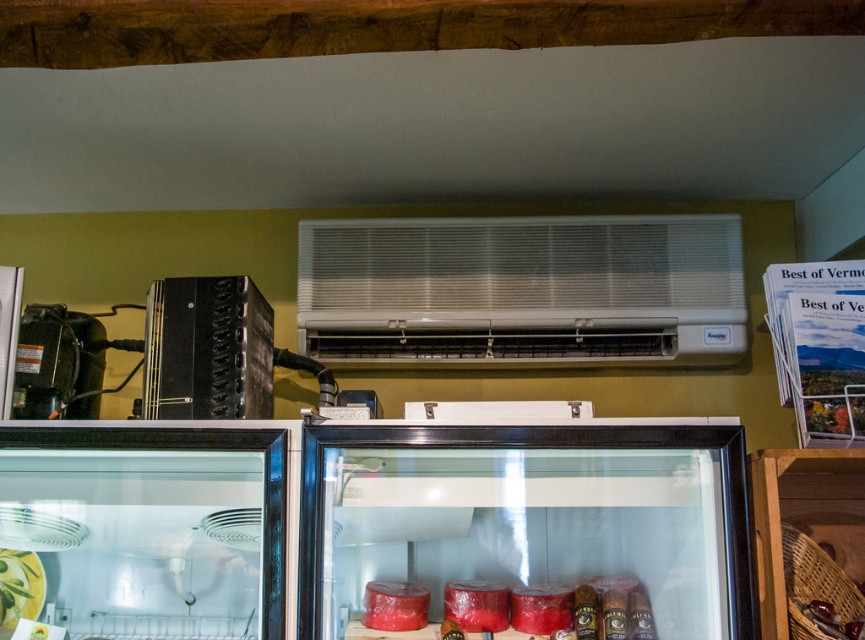
Question: Is the position of red matte container at center more distant than that of glossy red meat at center?

Choices:
 (A) no
 (B) yes

Answer: (B)

Question: Observing the image, what is the correct spatial positioning of white plastic air conditioner at upper center in reference to glossy red meat at center?

Choices:
 (A) above
 (B) below

Answer: (A)

Question: Is black matte accordion at left above red matte container at center?

Choices:
 (A) yes
 (B) no

Answer: (A)

Question: Which object appears farthest from the camera in this image?

Choices:
 (A) shiny red meat at center
 (B) red matte container at center
 (C) glossy red meat at center
 (D) metallic black air conditioner at upper center

Answer: (B)

Question: Which is nearer to the black matte accordion at left?

Choices:
 (A) red matte container at center
 (B) transparent glass door at center
 (C) shiny red meat at center

Answer: (B)

Question: Which point is closer to the camera?

Choices:
 (A) wooden basket at lower right
 (B) transparent glass door at center
 (C) black matte accordion at left

Answer: (B)